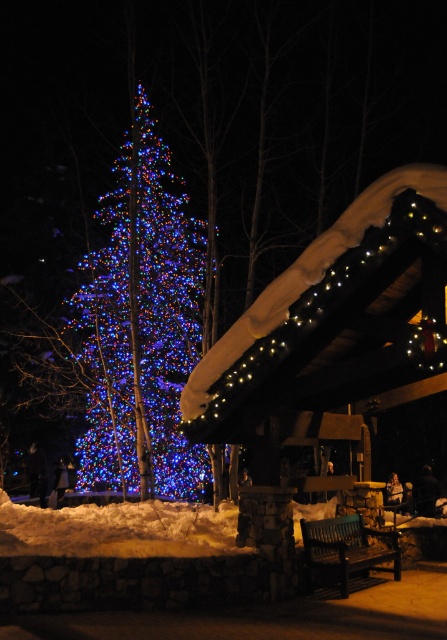
Does point (156, 340) come behind point (354, 525)?

Yes, it is behind point (354, 525).

Can you confirm if illuminated plastic christmas tree at left is smaller than dark wood bench at center?

Incorrect, illuminated plastic christmas tree at left is not smaller in size than dark wood bench at center.

You are a GUI agent. You are given a task and a screenshot of the screen. Output one action in this format:
    pyautogui.click(x=<x>, y=<y>)
    Task: Click on the illuminated plastic christmas tree at left
    Image resolution: width=447 pixels, height=640 pixels.
    Given the screenshot: What is the action you would take?
    pyautogui.click(x=140, y=326)